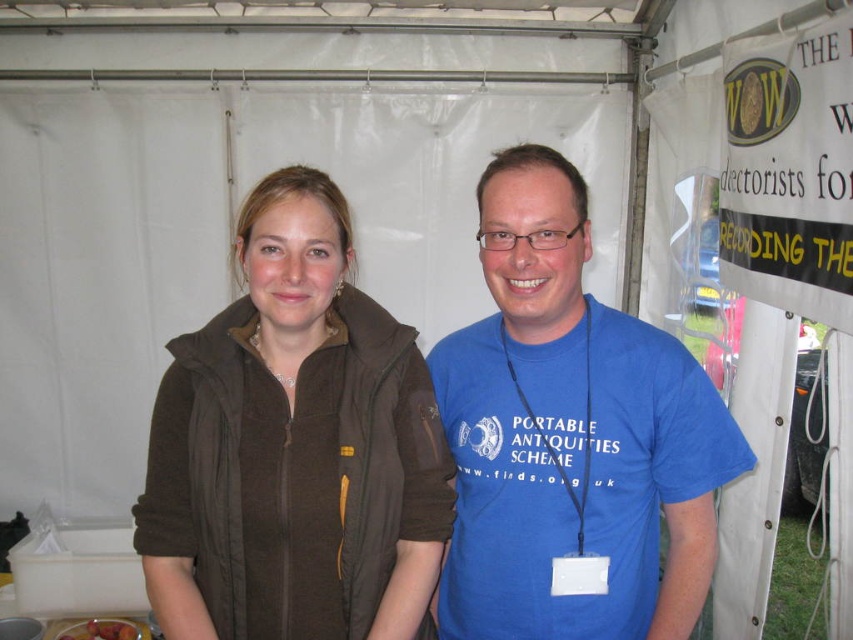
Question: In this image, where is brown fleece jacket at center located relative to blue cotton t-shirt at center?

Choices:
 (A) right
 (B) left

Answer: (B)

Question: Is brown fleece jacket at center positioned in front of blue cotton t-shirt at center?

Choices:
 (A) yes
 (B) no

Answer: (B)

Question: In this image, where is brown fleece jacket at center located relative to blue cotton t-shirt at center?

Choices:
 (A) above
 (B) below

Answer: (B)

Question: Which point appears closest to the camera in this image?

Choices:
 (A) (515, 586)
 (B) (318, 397)

Answer: (B)